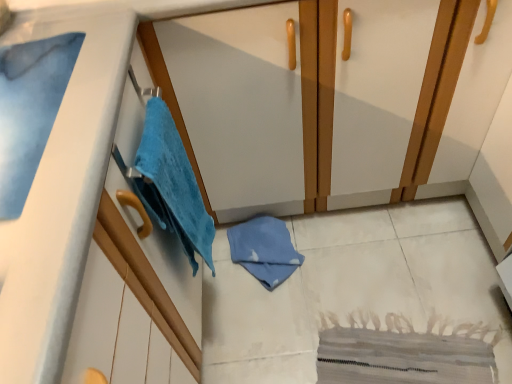
Question: Is point (441, 122) positioned closer to the camera than point (29, 160)?

Choices:
 (A) closer
 (B) farther

Answer: (B)

Question: In the image, is matte white dresser at center positioned in front of or behind blue soft towel at upper left?

Choices:
 (A) front
 (B) behind

Answer: (B)

Question: Estimate the real-world distances between objects in this image. Which object is farther from the matte white dresser at center?

Choices:
 (A) blue soft towel at upper left
 (B) blue soft towel at left

Answer: (A)

Question: Estimate the real-world distances between objects in this image. Which object is closer to the matte white dresser at center?

Choices:
 (A) blue soft towel at left
 (B) blue soft towel at upper left

Answer: (A)